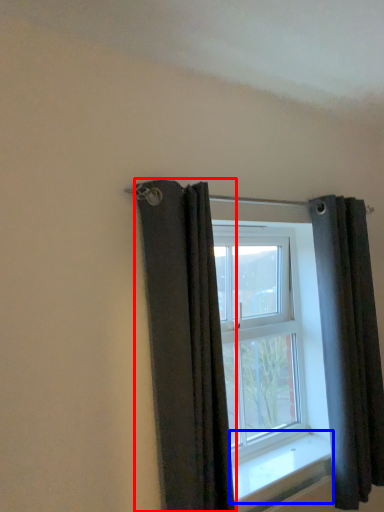
Question: Which point is closer to the camera, curtain (highlighted by a red box) or window sill (highlighted by a blue box)?

Choices:
 (A) curtain
 (B) window sill

Answer: (A)